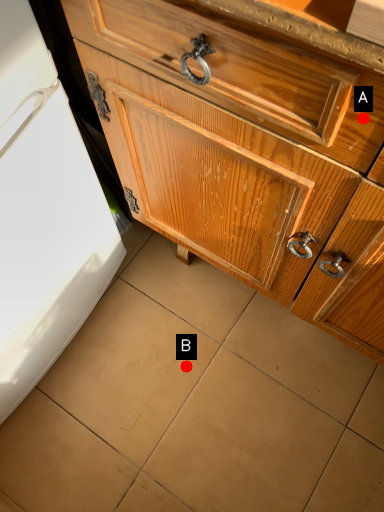
Question: Two points are circled on the image, labeled by A and B beside each circle. Which point is farther from the camera taking this photo?

Choices:
 (A) A is further
 (B) B is further

Answer: (B)